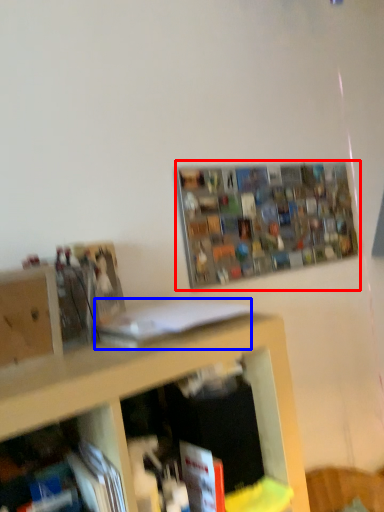
Question: Which object is closer to the camera taking this photo, shelf (highlighted by a red box) or book (highlighted by a blue box)?

Choices:
 (A) shelf
 (B) book

Answer: (B)